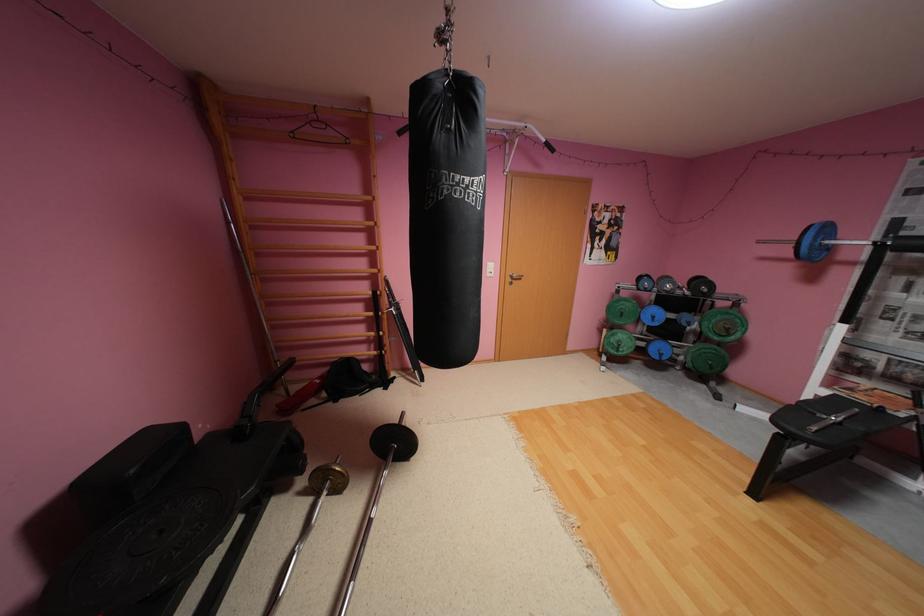
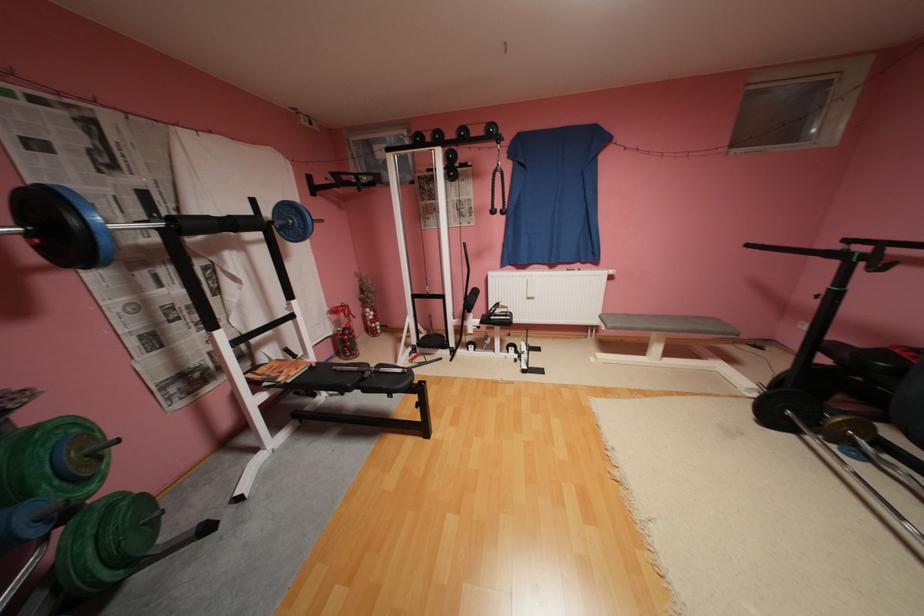
The point at (737, 334) is marked in the first image. Where is the corresponding point in the second image?

(111, 459)